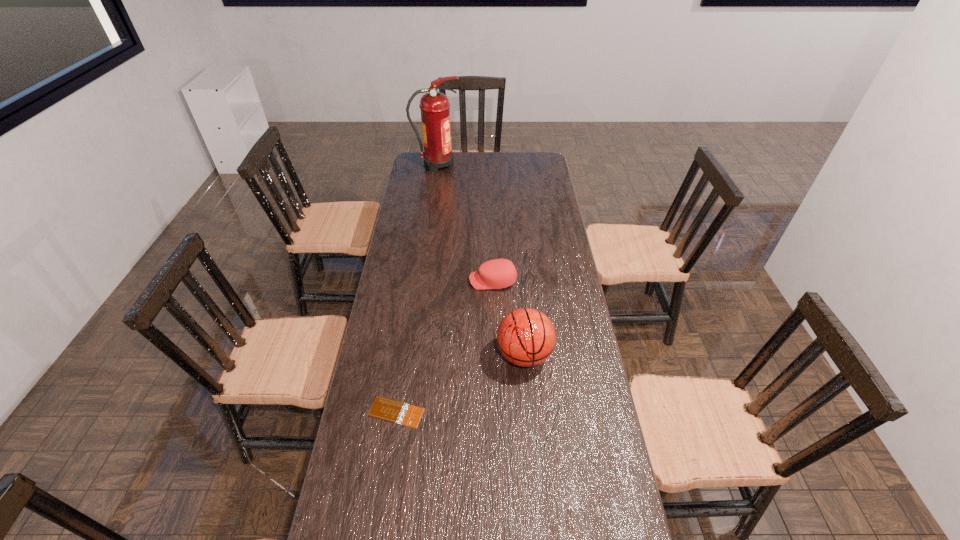
Locate an element on the screen. vacant region located on the front-facing side of the third tallest object is located at coordinates tap(407, 281).

The image size is (960, 540). I want to click on vacant area located on the front-facing side of the third tallest object, so point(420,281).

Where is `vacant space located 0.290m on the front-facing side of the third tallest object`? This screenshot has width=960, height=540. vacant space located 0.290m on the front-facing side of the third tallest object is located at coordinates (395, 281).

In order to click on free point located 0.200m on the right of the chocolate bar in this screenshot , I will do `click(492, 412)`.

You are a GUI agent. You are given a task and a screenshot of the screen. Output one action in this format:
    pyautogui.click(x=<x>, y=<y>)
    Task: Click on the object situated at the far edge
    
    Given the screenshot: What is the action you would take?
    pyautogui.click(x=435, y=108)

Identify the location of fire extinguisher that is at the left edge. (435, 108).

Identify the location of chocolate bar that is at the left edge. (386, 409).

The height and width of the screenshot is (540, 960). In order to click on object that is at the right edge in this screenshot , I will do `click(526, 337)`.

Locate an element on the screen. The width and height of the screenshot is (960, 540). object that is at the far left corner is located at coordinates (435, 108).

Locate an element on the screen. Image resolution: width=960 pixels, height=540 pixels. vacant region at the far edge is located at coordinates (453, 160).